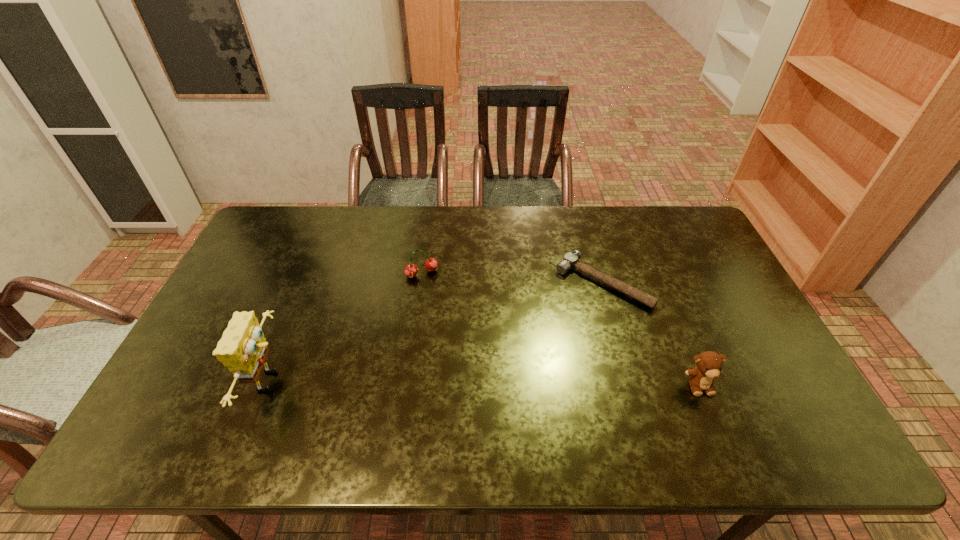
Where is `free point located on the striking face of the shortest object`? Image resolution: width=960 pixels, height=540 pixels. free point located on the striking face of the shortest object is located at coordinates (541, 343).

Where is `vacant area located on the striking face of the shortest object`? This screenshot has width=960, height=540. vacant area located on the striking face of the shortest object is located at coordinates (522, 364).

Locate an element on the screen. sponge positioned at the near edge is located at coordinates click(243, 349).

Locate an element on the screen. The height and width of the screenshot is (540, 960). teddy bear at the near edge is located at coordinates (709, 364).

The image size is (960, 540). I want to click on free location at the far edge, so [502, 213].

This screenshot has height=540, width=960. In order to click on vacant region at the near edge in this screenshot , I will do `click(496, 395)`.

In the image, there is a desktop. At what (x,y) coordinates should I click in order to perform the action: click on vacant space at the right edge. Please return your answer as a coordinate pair (x, y). The height and width of the screenshot is (540, 960). Looking at the image, I should click on (711, 278).

The height and width of the screenshot is (540, 960). Identify the location of vacant space at the far left corner of the desktop. (285, 238).

In the image, there is a desktop. Where is `free space at the far right corner`? The width and height of the screenshot is (960, 540). free space at the far right corner is located at coordinates pos(693,222).

I want to click on unoccupied area between the teddy bear and the shortest object, so click(651, 334).